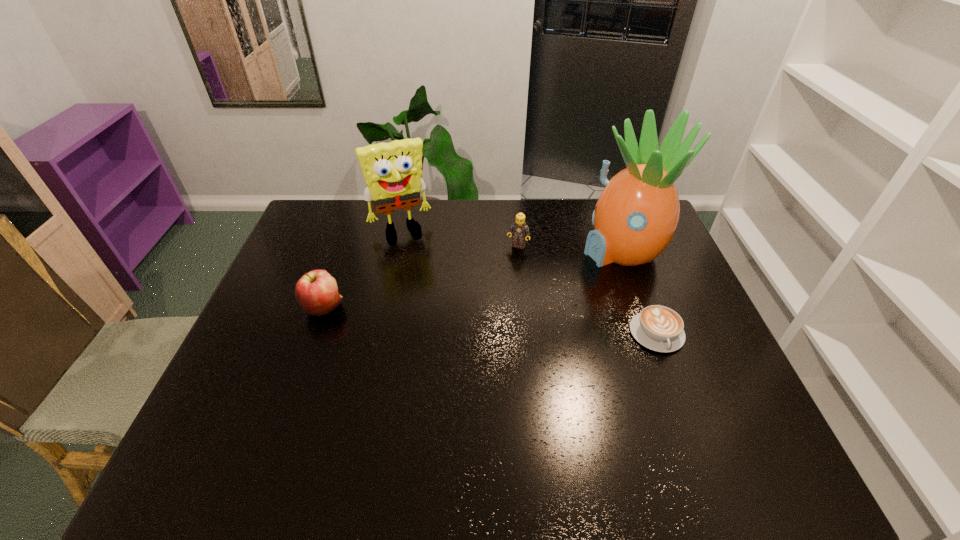
Image resolution: width=960 pixels, height=540 pixels. Find the location of `cappuccino located in the right edge section of the desktop`. cappuccino located in the right edge section of the desktop is located at coordinates (659, 328).

Locate an element on the screen. Image resolution: width=960 pixels, height=540 pixels. pineapple positioned at the right edge is located at coordinates (636, 215).

Image resolution: width=960 pixels, height=540 pixels. I want to click on object present at the far right corner, so click(x=636, y=215).

Where is `vacant space at the far edge of the desktop`? This screenshot has height=540, width=960. vacant space at the far edge of the desktop is located at coordinates (535, 221).

Where is `vacant space at the near edge of the desktop`? vacant space at the near edge of the desktop is located at coordinates (639, 426).

In the image, there is a desktop. Identify the location of vacant space at the left edge. (265, 382).

Identify the location of vacant space at the right edge of the desktop. (719, 346).

What are the coordinates of `vacant position at the near right corner of the desktop` in the screenshot? It's located at (713, 395).

Image resolution: width=960 pixels, height=540 pixels. Identify the location of vacant space that's between the shortest object and the leftmost object. (491, 321).

I want to click on vacant area that lies between the sponge and the Lego, so click(x=459, y=238).